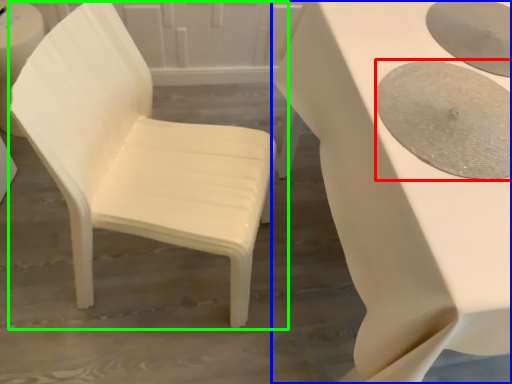
Question: Based on their relative distances, which object is nearer to oval (highlighted by a red box)? Choose from table (highlighted by a blue box) and chair (highlighted by a green box).

Choices:
 (A) table
 (B) chair

Answer: (A)